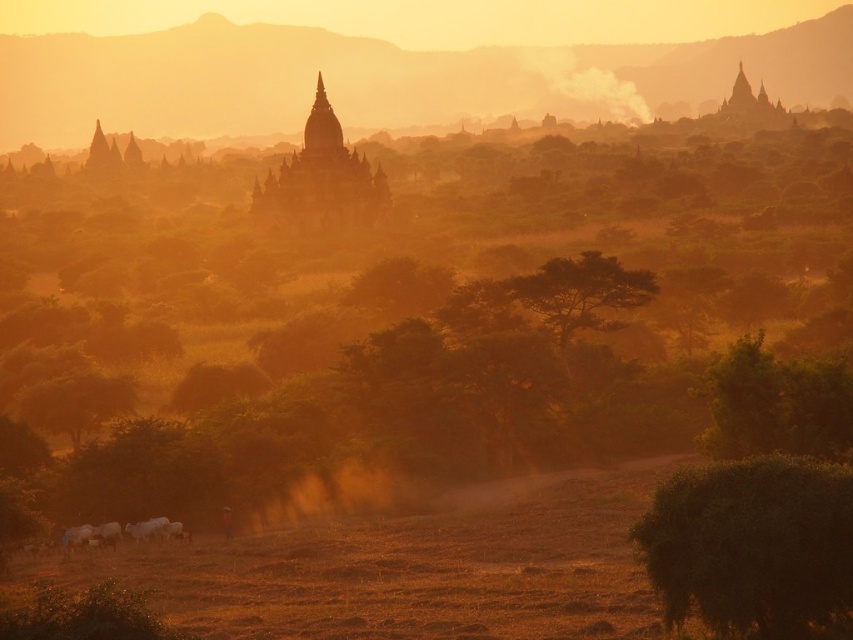
Question: Which point is farther to the camera?

Choices:
 (A) foggy haze at upper center
 (B) matte orange temple at center

Answer: (A)

Question: Which point is farther from the camera taking this photo?

Choices:
 (A) (120, 392)
 (B) (645, 516)

Answer: (A)

Question: Where is green leafy tree at center right located in relation to green leafy tree at center in the image?

Choices:
 (A) above
 (B) below

Answer: (B)

Question: Is green fuzzy bush at lower right to the left of green leafy tree at lower left from the viewer's perspective?

Choices:
 (A) yes
 (B) no

Answer: (B)

Question: Estimate the real-world distances between objects in this image. Which object is farther from the foggy haze at upper center?

Choices:
 (A) green leafy tree at lower left
 (B) green fuzzy bush at lower right
 (C) green leafy tree at center

Answer: (B)

Question: Is foggy haze at upper center to the left of green fuzzy bush at lower right from the viewer's perspective?

Choices:
 (A) yes
 (B) no

Answer: (B)